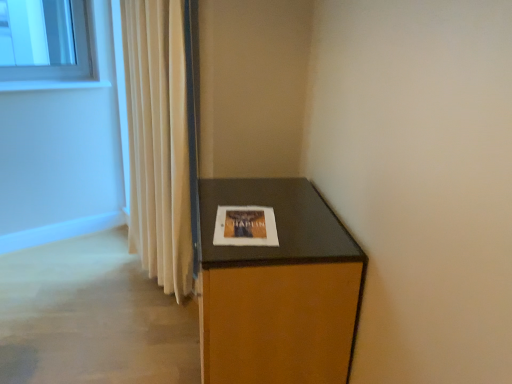
Where is `blank space situated above white glossy window sill at upper left (from a real-world perspective)`? This screenshot has height=384, width=512. blank space situated above white glossy window sill at upper left (from a real-world perspective) is located at coordinates click(49, 79).